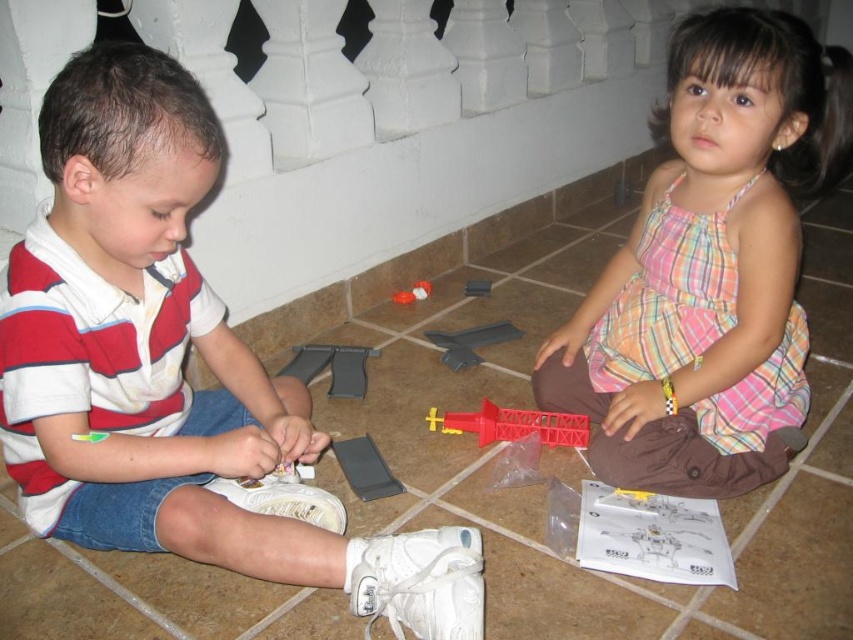
Question: Does white matte shoe at lower left lie in front of matte plastic toy at center?

Choices:
 (A) yes
 (B) no

Answer: (A)

Question: Does red plastic tower at center lie in front of matte plastic toy at center?

Choices:
 (A) yes
 (B) no

Answer: (A)

Question: Is white matte shoe at lower left positioned before red plastic toy at center?

Choices:
 (A) yes
 (B) no

Answer: (A)

Question: Which of these objects is positioned farthest from the pink plaid dress at center?

Choices:
 (A) white matte shoe at lower left
 (B) matte plastic toy at center
 (C) red plastic tower at center
 (D) red plastic toy at center

Answer: (D)

Question: Which of the following is the closest to the observer?

Choices:
 (A) (358, 365)
 (B) (486, 291)

Answer: (A)

Question: Among these objects, which one is farthest from the camera?

Choices:
 (A) matte plastic toy at center
 (B) white matte shoe at lower left
 (C) pink plaid dress at center

Answer: (A)